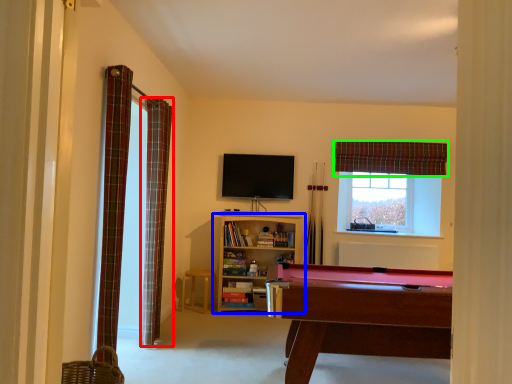
Question: Based on their relative distances, which object is farther from curtain (highlighted by a red box)? Choose from shelf (highlighted by a blue box) and curtain (highlighted by a green box).

Choices:
 (A) shelf
 (B) curtain

Answer: (B)